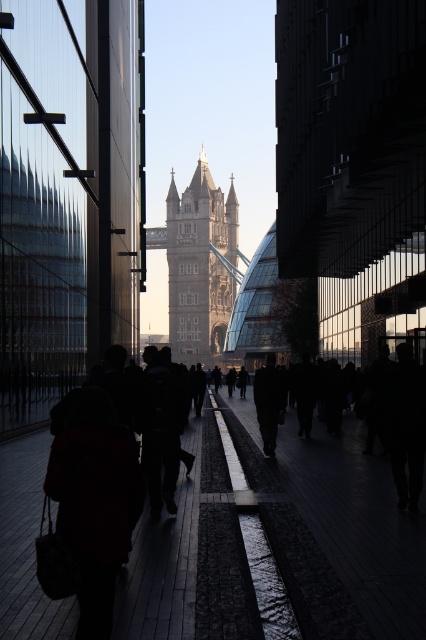
Question: Which object is closer to the camera taking this photo?

Choices:
 (A) dark fabric coat at center
 (B) stone tower at center
 (C) dark red coat at center
 (D) dark gray concrete pavement at center

Answer: (C)

Question: Does dark gray concrete pavement at center appear over stone tower at center?

Choices:
 (A) no
 (B) yes

Answer: (A)

Question: Among these objects, which one is nearest to the camera?

Choices:
 (A) dark fabric coat at center
 (B) stone tower at center
 (C) dark gray concrete pavement at center

Answer: (C)

Question: Considering the real-world distances, which object is closest to the dark fabric coat at center?

Choices:
 (A) dark gray concrete pavement at center
 (B) stone tower at center

Answer: (A)

Question: Can you confirm if dark red coat at center is smaller than stone tower at center?

Choices:
 (A) yes
 (B) no

Answer: (A)

Question: Can you confirm if dark red coat at center is positioned to the left of dark fabric coat at center?

Choices:
 (A) no
 (B) yes

Answer: (B)